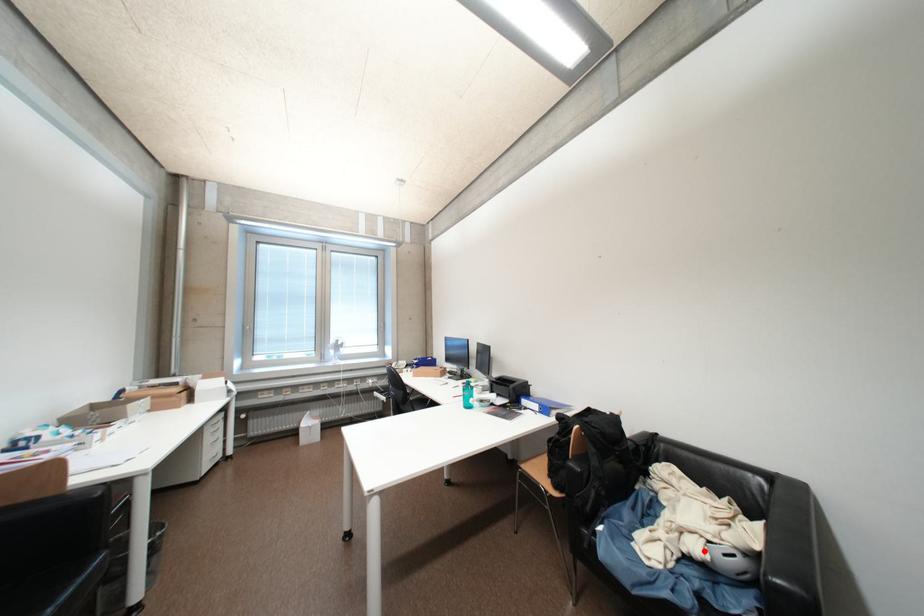
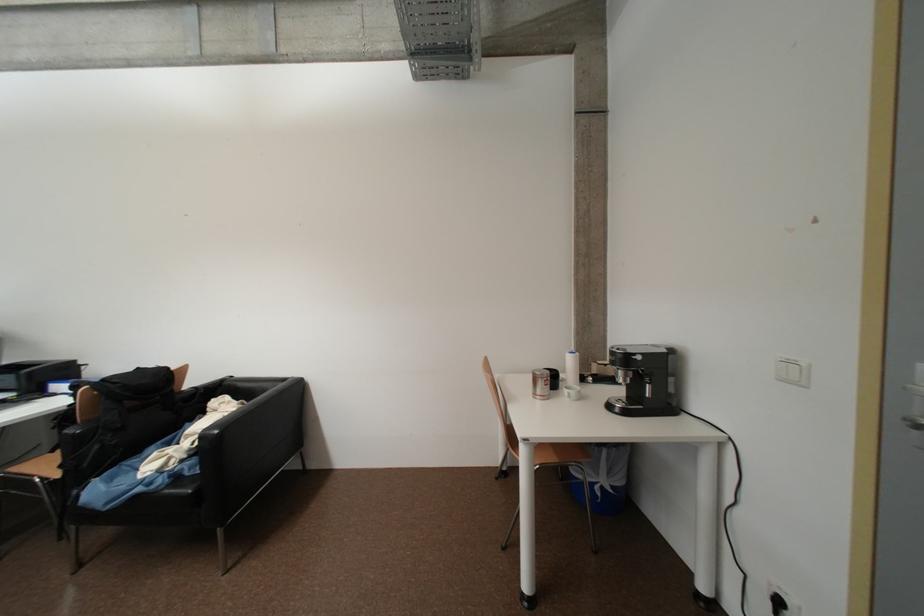
Question: I am providing you with two images of the same scene from different viewpoints. A red point is marked on the first image. Is the red point's position out of view in image 2?

Choices:
 (A) Yes
 (B) No

Answer: (A)